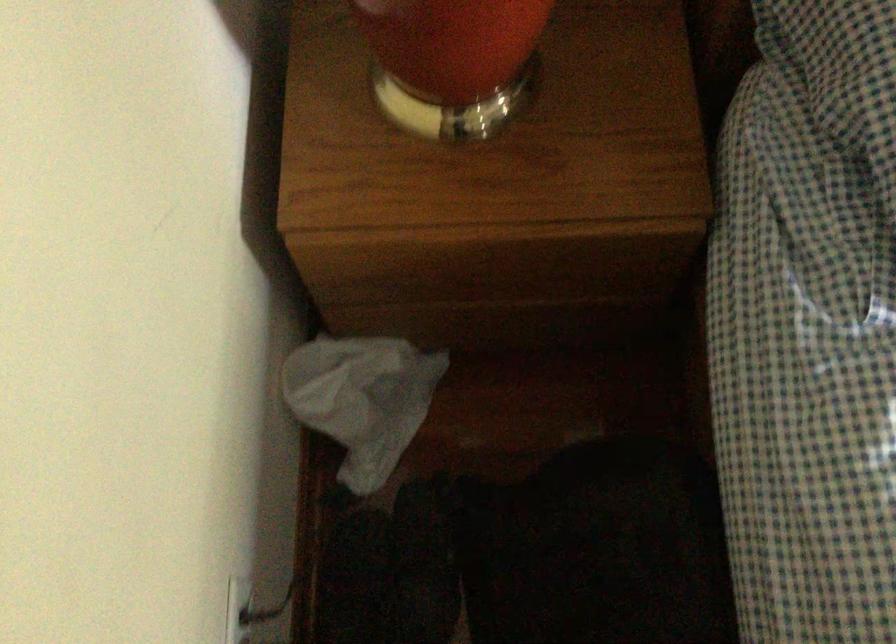
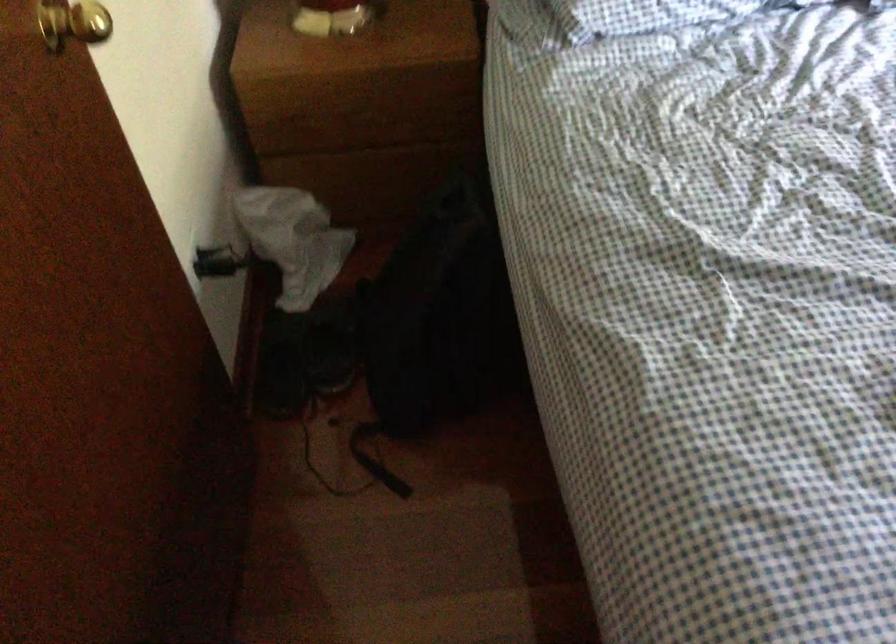
In the second image, find the point that corresponds to the point at 420,561 in the first image.

(332, 345)